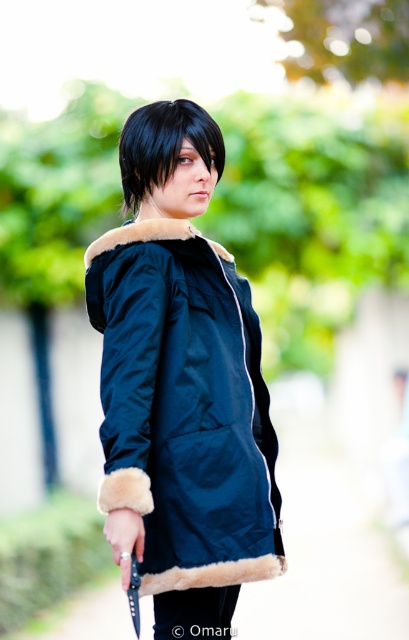
You are a photographer trying to capture a closeup of the knife the person is holding. The knife is at point (143, 419). You are currently 8.22 feet away from the subject. Should you zoom in or move closer to get a better closeup?

Since the point (143, 419) is 8.22 feet from the camera, you should move closer to the subject to get a better closeup of the knife rather than relying on zooming in, as moving closer will provide a clearer image with less distortion.

You are a drone operator trying to capture a photo of the person in the park. You have two markers placed at point [139,282] and point [220,131]. Which marker should you use to ensure the person is centered in your shot?

Point [139,282] is in front of point [220,131], so you should use point [139,282] to ensure the person is centered in your shot.